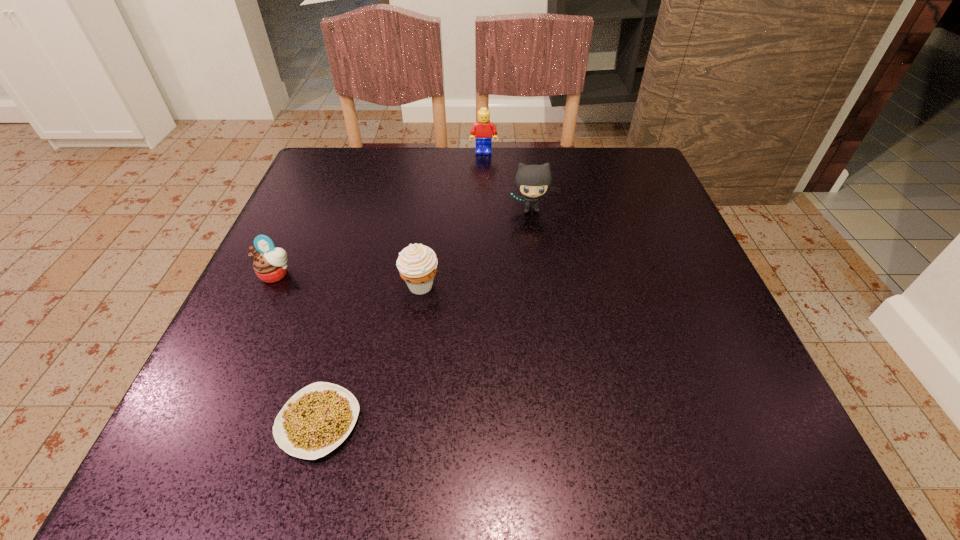
Where is `vacant space that's between the second object from right to left and the second farthest object`? The width and height of the screenshot is (960, 540). vacant space that's between the second object from right to left and the second farthest object is located at coordinates (507, 181).

Where is `free space between the second object from right to left and the rightmost object`? This screenshot has width=960, height=540. free space between the second object from right to left and the rightmost object is located at coordinates (507, 181).

The image size is (960, 540). Find the location of `free space that is in between the left muffin and the rightmost object`. free space that is in between the left muffin and the rightmost object is located at coordinates (403, 242).

I want to click on vacant space that's between the fourth nearest object and the third object from left to right, so click(475, 247).

The height and width of the screenshot is (540, 960). Identify the location of vacant space in between the fourth object from left to right and the kitten. 507,181.

You are a GUI agent. You are given a task and a screenshot of the screen. Output one action in this format:
    pyautogui.click(x=<x>, y=<y>)
    Task: Click on the free space between the kitten and the Lego
    The width and height of the screenshot is (960, 540).
    Given the screenshot: What is the action you would take?
    pyautogui.click(x=507, y=181)

Find the location of a particular element. This screenshot has width=960, height=540. free spot between the leftmost object and the right muffin is located at coordinates (348, 280).

Locate an element on the screen. The height and width of the screenshot is (540, 960). free area in between the left muffin and the right muffin is located at coordinates (348, 280).

Image resolution: width=960 pixels, height=540 pixels. Find the location of `object that is the closest one to the shorter muffin`. object that is the closest one to the shorter muffin is located at coordinates (417, 263).

Where is `object that can be found as the closest to the farthest object`? Image resolution: width=960 pixels, height=540 pixels. object that can be found as the closest to the farthest object is located at coordinates (532, 181).